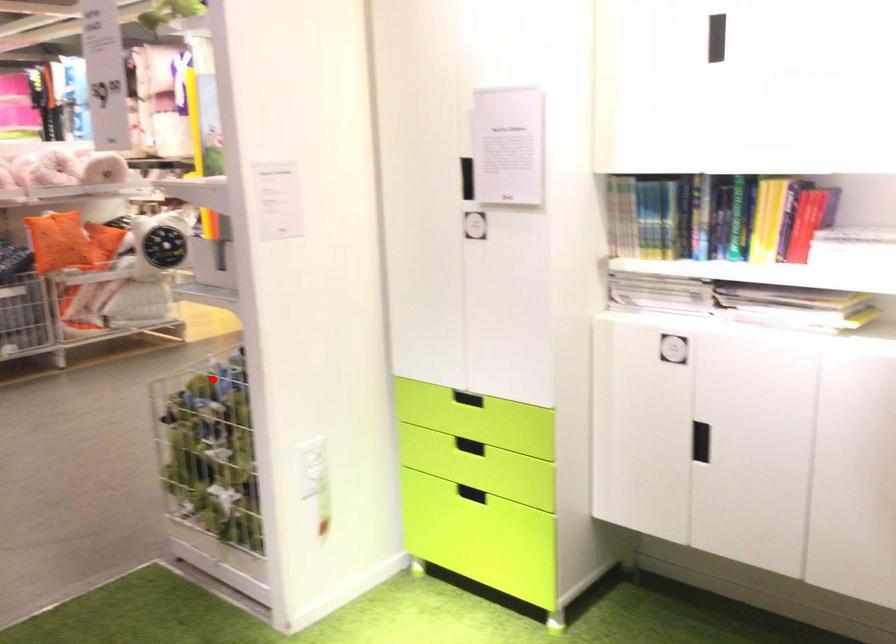
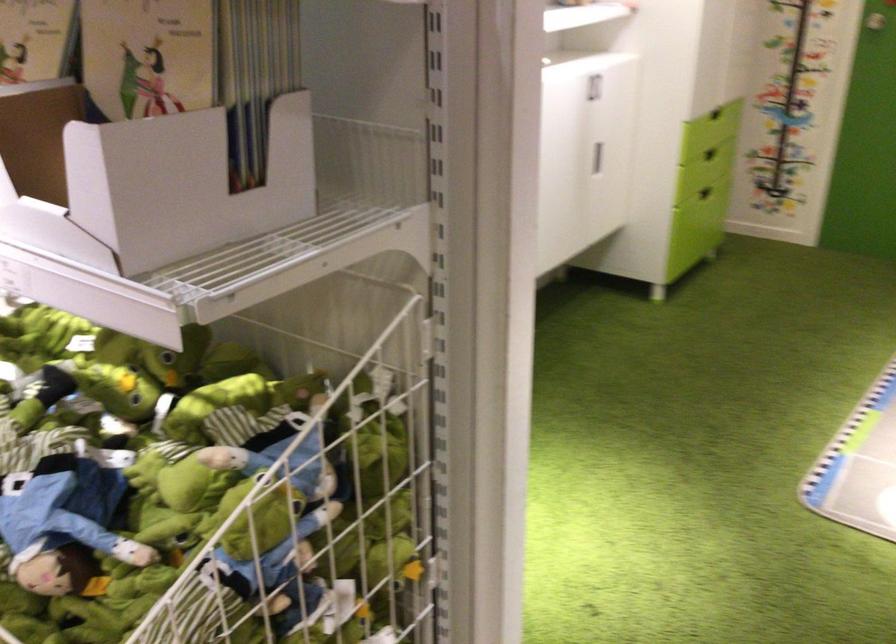
Question: I am providing you with two images of the same scene from different viewpoints. Image1 has a red point marked. In image2, the corresponding 3D location appears at what relative position? Reply with the corresponding letter.

Choices:
 (A) Closer
 (B) Farther

Answer: (A)